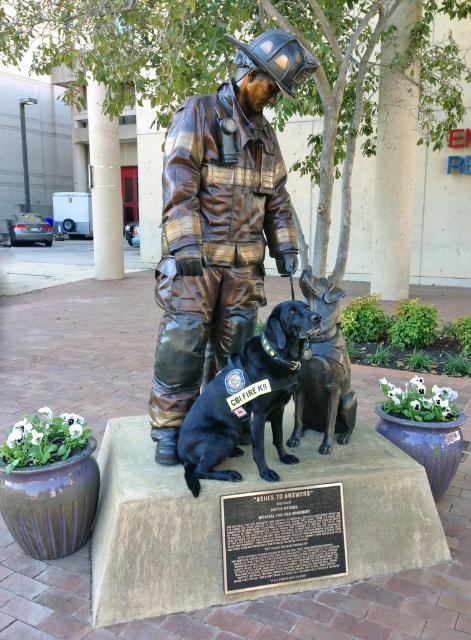
You are a photographer wanting to capture the bronze statue of the firefighter and his K9 partner. You notice a shiny black dog at center at point (246, 400). Where should you position your camera to ensure the dog is in the center of your photo?

Position your camera directly facing the point (246, 400) where the shiny black dog at center is located to ensure it is centered in your photo.